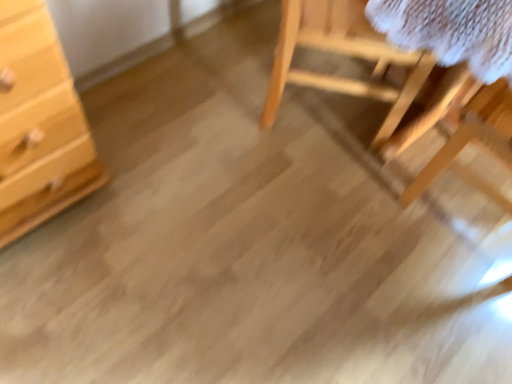
You are a GUI agent. You are given a task and a screenshot of the screen. Output one action in this format:
    pyautogui.click(x=<x>, y=<y>)
    Task: Click on the free space on the front side of natural wood chair at upper right
    
    Given the screenshot: What is the action you would take?
    pyautogui.click(x=303, y=188)